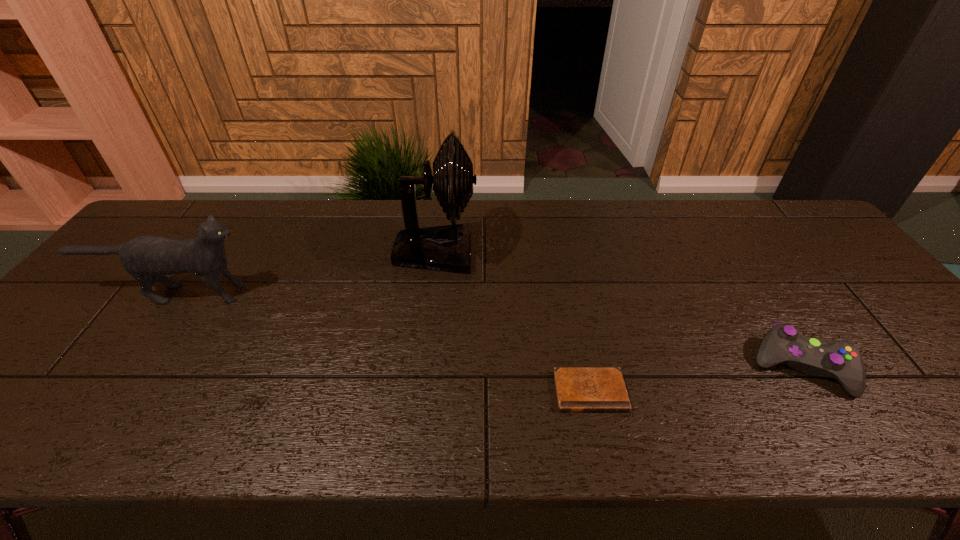
Image resolution: width=960 pixels, height=540 pixels. Find the location of `fan`. fan is located at coordinates (446, 247).

Identify the location of the tallest object. The image size is (960, 540). (446, 247).

I want to click on the second tallest object, so click(147, 258).

You are a GUI agent. You are given a task and a screenshot of the screen. Output one action in this format:
    pyautogui.click(x=<x>, y=<y>)
    Task: Click on the second farthest object
    
    Given the screenshot: What is the action you would take?
    pyautogui.click(x=147, y=258)

This screenshot has height=540, width=960. In order to click on control in this screenshot , I will do `click(839, 359)`.

Locate an element on the screen. The image size is (960, 540). the rightmost object is located at coordinates (839, 359).

Where is `diary`? The height and width of the screenshot is (540, 960). diary is located at coordinates (578, 389).

This screenshot has width=960, height=540. Find the location of `the second object from right to left`. the second object from right to left is located at coordinates (578, 389).

Locate an element on the screen. The height and width of the screenshot is (540, 960). vacant space situated 0.080m in front of the third object from right to left to blow air is located at coordinates (504, 252).

The width and height of the screenshot is (960, 540). Identify the location of vacant position located 0.400m on the front-facing side of the third shortest object. (407, 293).